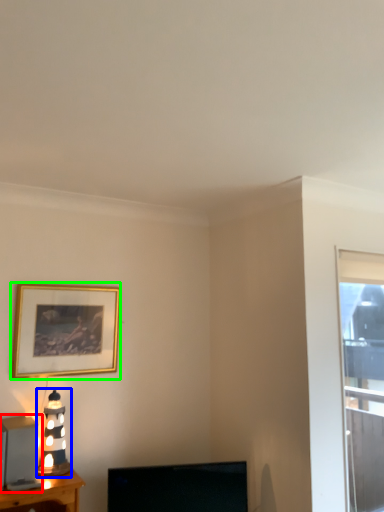
Question: Which object is positioned farthest from appliance (highlighted by a red box)? Select from table lamp (highlighted by a blue box) and picture frame (highlighted by a green box).

Choices:
 (A) table lamp
 (B) picture frame

Answer: (B)